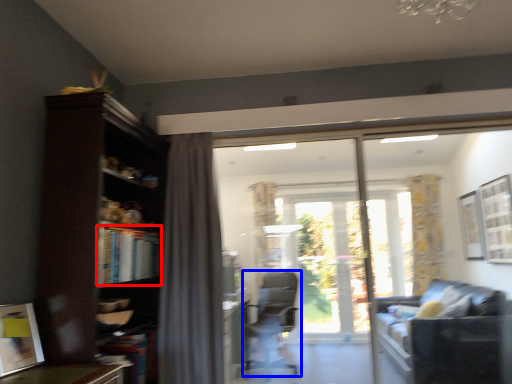
Question: Among these objects, which one is farthest to the camera, book (highlighted by a red box) or chair (highlighted by a blue box)?

Choices:
 (A) book
 (B) chair

Answer: (B)